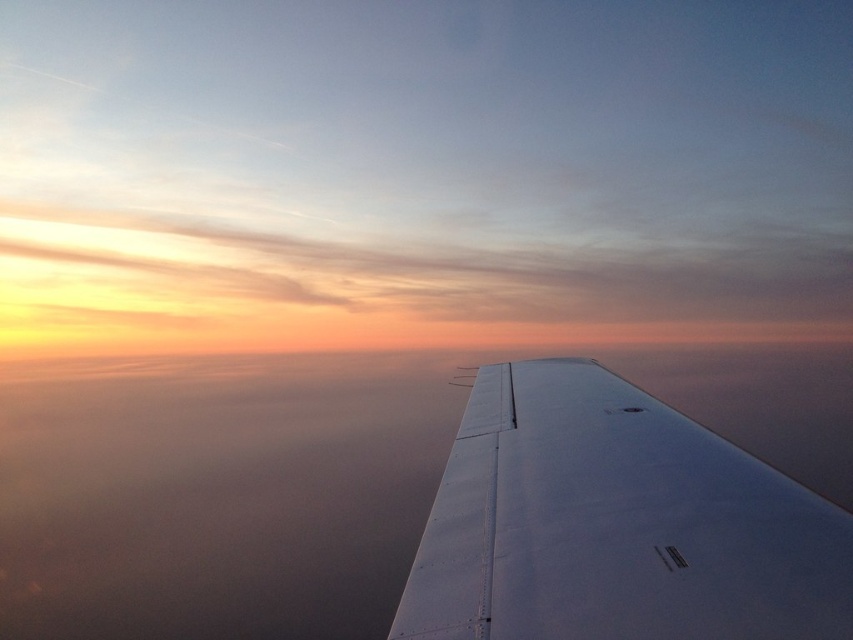
Measure the distance from transparent glass airplane window at lower right to transparent glass airplane window at center.

5.71 feet

Can you confirm if transparent glass airplane window at lower right is taller than transparent glass airplane window at center?

No, transparent glass airplane window at lower right is not taller than transparent glass airplane window at center.

The height and width of the screenshot is (640, 853). I want to click on transparent glass airplane window at lower right, so click(675, 556).

Locate an element on the screen. transparent glass airplane window at lower right is located at coordinates (675, 556).

What do you see at coordinates (616, 524) in the screenshot?
I see `white matte wing at center` at bounding box center [616, 524].

Is point (502, 493) farther from viewer compared to point (680, 557)?

Yes, point (502, 493) is farther from viewer.

The image size is (853, 640). What do you see at coordinates (616, 524) in the screenshot? I see `white matte wing at center` at bounding box center [616, 524].

The image size is (853, 640). I want to click on white matte wing at center, so click(x=616, y=524).

Is white matte wing at center below transparent glass airplane window at center?

Correct, white matte wing at center is located below transparent glass airplane window at center.

Who is more distant from viewer, (711, 572) or (624, 412)?

The point (624, 412) is more distant.

Does point (462, 540) come behind point (630, 406)?

No, it is not.

Find the location of `white matte wing at center`. white matte wing at center is located at coordinates (616, 524).